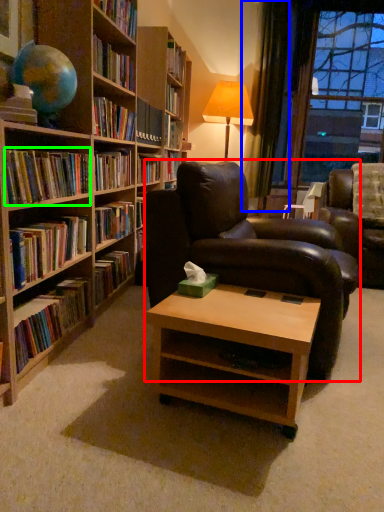
Question: Which object is the closest to the chair (highlighted by a red box)? Choose among these: curtain (highlighted by a blue box) or book (highlighted by a green box).

Choices:
 (A) curtain
 (B) book

Answer: (B)